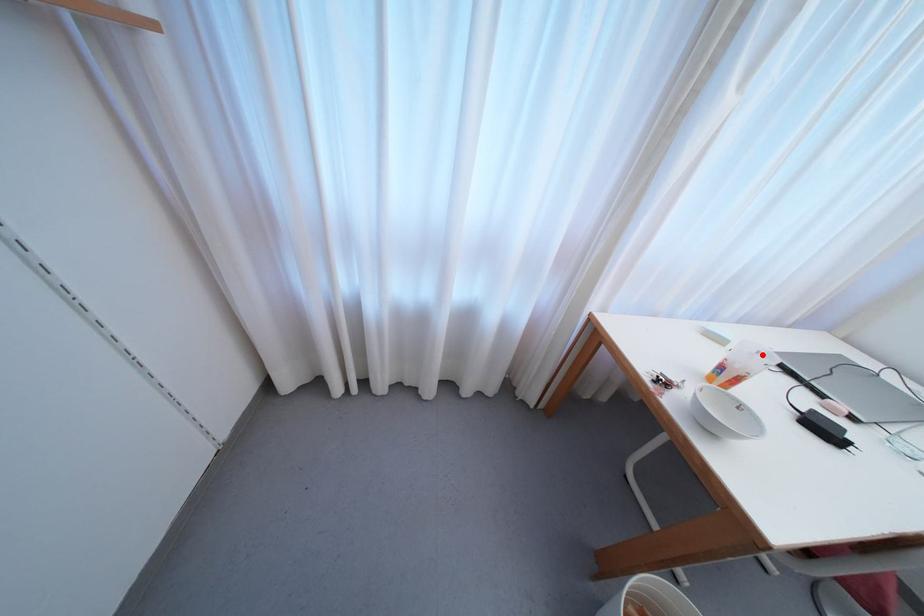
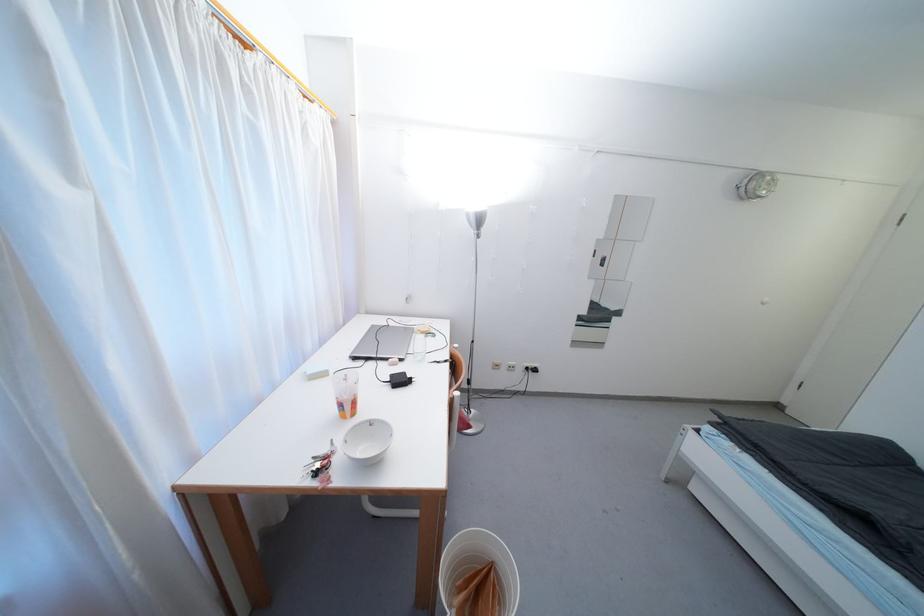
Where in the second image is the point corresponding to the highlighted location from the first image?

(349, 378)